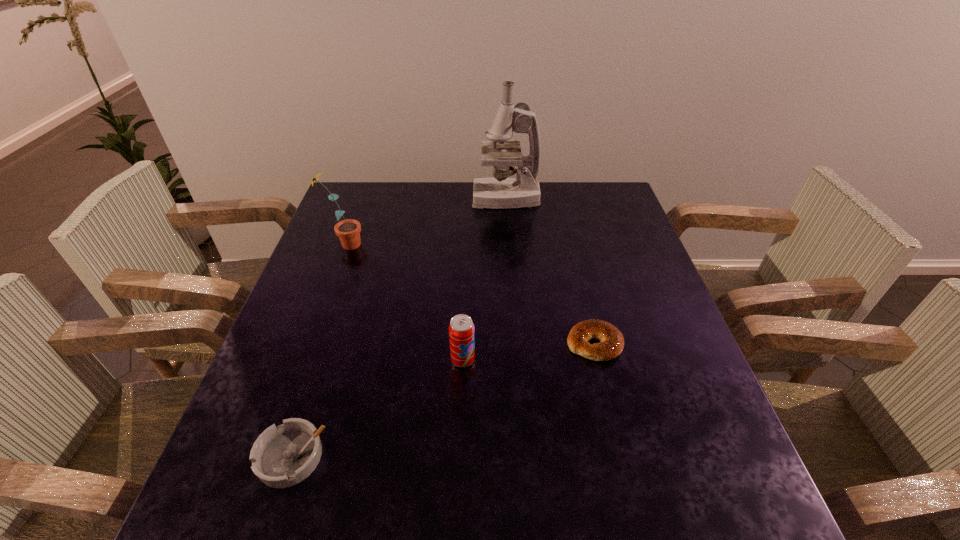
At what (x,y) coordinates should I click in order to perform the action: click on blank area at the right edge. Please return your answer as a coordinate pair (x, y). Looking at the image, I should click on (585, 233).

You are a GUI agent. You are given a task and a screenshot of the screen. Output one action in this format:
    pyautogui.click(x=<x>, y=<y>)
    Task: Click on the vacant point at the near left corner
    The height and width of the screenshot is (540, 960).
    Given the screenshot: What is the action you would take?
    pyautogui.click(x=297, y=510)

Find the location of `free spot between the third shortest object and the bagel`. free spot between the third shortest object and the bagel is located at coordinates (529, 352).

Locate an element on the screen. The width and height of the screenshot is (960, 540). empty space between the soda can and the sunflower is located at coordinates (403, 302).

Image resolution: width=960 pixels, height=540 pixels. I want to click on free space between the bagel and the microscope, so click(x=550, y=271).

Find the location of a particular element. Image resolution: width=960 pixels, height=540 pixels. vacant area that lies between the nearest object and the soda can is located at coordinates (377, 408).

Where is `free space between the tallest object and the bagel`? free space between the tallest object and the bagel is located at coordinates (550, 271).

At what (x,y) coordinates should I click in order to perform the action: click on free area in between the farthest object and the second tallest object. Please return your answer as a coordinate pair (x, y). Looking at the image, I should click on (425, 221).

Find the location of a particular element. The image size is (960, 540). empty space between the tallest object and the bagel is located at coordinates (550, 271).

Image resolution: width=960 pixels, height=540 pixels. What are the coordinates of `free spot between the sunflower and the nearest object` in the screenshot? It's located at (318, 350).